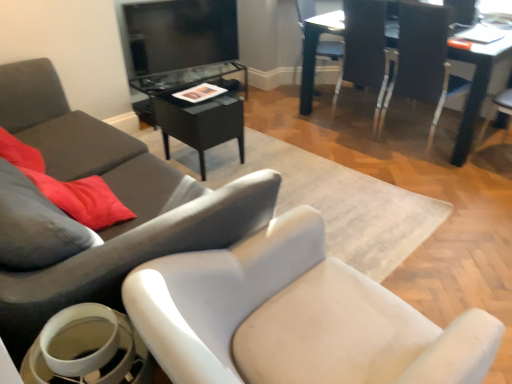
Question: From a real-world perspective, is black glass table at center, acting as the 2th table starting from the right, physically located above or below white glossy cup at lower left?

Choices:
 (A) below
 (B) above

Answer: (A)

Question: Is point (229, 84) closer or farther from the camera than point (92, 309)?

Choices:
 (A) farther
 (B) closer

Answer: (A)

Question: Which of these objects is positioned farthest from the white plastic chair at upper right, the 3th chair from the left?

Choices:
 (A) white glossy cup at lower left
 (B) wooden table at upper right, marked as the 2th table in a left-to-right arrangement
 (C) matte black tv stand at upper center
 (D) light gray fabric chair at lower left, the 2th chair positioned from the left
 (E) white plastic chair at upper right, marked as the 5th chair in a left-to-right arrangement

Answer: (A)

Question: Estimate the real-world distances between objects in this image. Which object is closer to the matte gray chair at center, the first chair when ordered from left to right?

Choices:
 (A) wooden table at upper right, marked as the 2th table in a left-to-right arrangement
 (B) black glass table at center, the first table when ordered from left to right
 (C) white glossy cup at lower left
 (D) white plastic chair at upper right, marked as the 1th chair in a right-to-left arrangement
 (E) white glossy chair at upper right, marked as the 2th chair in a right-to-left arrangement

Answer: (C)